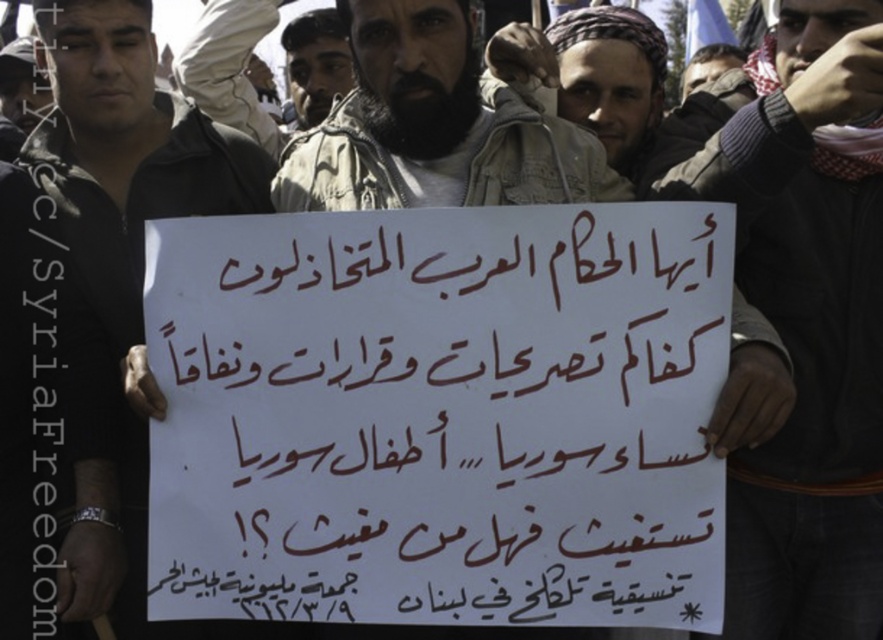
You are a photographer trying to capture the central figure holding the white paper placard at center. To ensure the placard is clearly visible in your photo, where should you position yourself relative to the group?

The white paper placard at center is located at point (439, 416), so positioning yourself directly in front of that coordinate would ensure the placard is clearly visible in your photo.

You are a photographer trying to capture the central figure holding the white paper sign at center. Given that the camera you are using has a 10cm depth of field, and the point at coordinates point (x=126, y=154) is exactly at the edge of the depth of field, will the white paper sign at center be in focus?

The point (x=126, y=154) corresponds to the white paper sign at center. Since the point is exactly at the edge of the depth of field, the white paper sign at center will be in focus but with reduced sharpness compared to the center of the depth of field.

You are a photographer trying to capture a clear shot of the white paper sign at center and the beige textured jacket at center. Based on their sizes in the image, which object would appear larger in your photo?

The white paper sign at center appears larger in the photo because it has a greater height compared to the beige textured jacket at center.